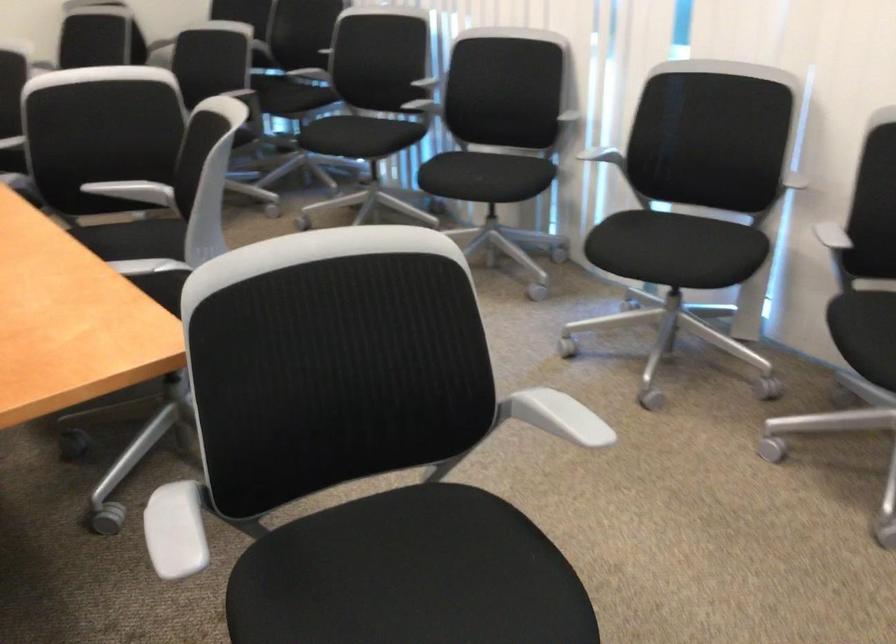
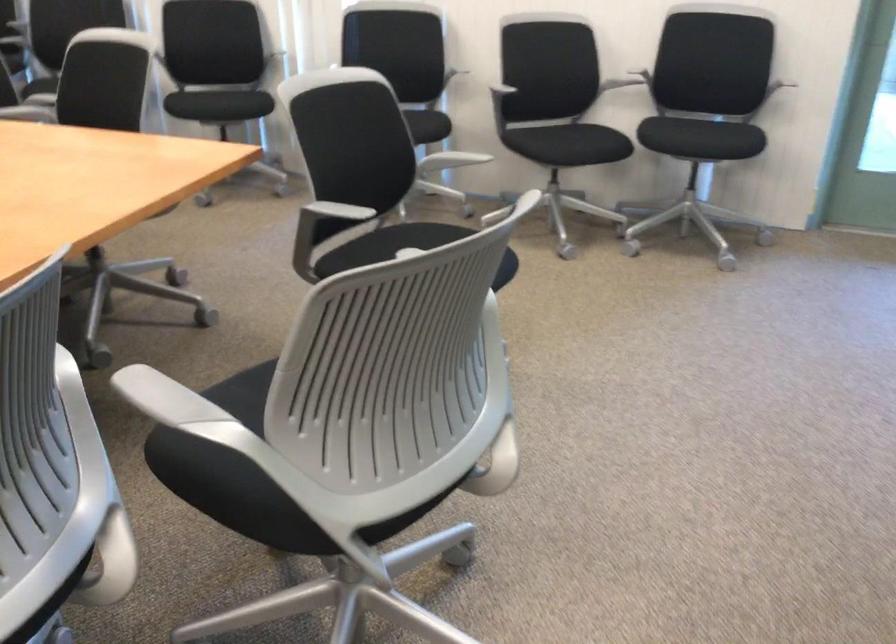
Locate, in the second image, the point that corresponds to (182,509) in the first image.

(332, 212)